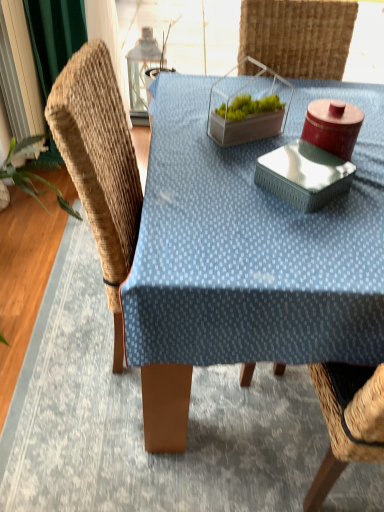
At what (x,y) coordinates should I click in order to perform the action: click on woven wood swivel chair at left. Please return your answer as a coordinate pair (x, y). The height and width of the screenshot is (512, 384). Looking at the image, I should click on (100, 165).

The height and width of the screenshot is (512, 384). What do you see at coordinates (100, 165) in the screenshot?
I see `woven wood swivel chair at left` at bounding box center [100, 165].

What do you see at coordinates (247, 256) in the screenshot? I see `blue fabric table at center` at bounding box center [247, 256].

Find the location of `blue fabric table at center`. blue fabric table at center is located at coordinates (247, 256).

Where is `woven wood swivel chair at left`? woven wood swivel chair at left is located at coordinates (100, 165).

Between woven wood swivel chair at left and blue fabric table at center, which one appears on the right side from the viewer's perspective?

blue fabric table at center is more to the right.

Is the depth of woven wood swivel chair at left less than that of blue fabric table at center?

No, it is not.

Which point is more distant from viewer, (123,230) or (379,114)?

The point (379,114) is more distant.

From the image's perspective, would you say woven wood swivel chair at left is positioned over blue fabric table at center?

Yes, from the image's perspective, woven wood swivel chair at left is above blue fabric table at center.

From a real-world perspective, who is located higher, woven wood swivel chair at left or blue fabric table at center?

From a 3D spatial view, woven wood swivel chair at left is above.

Between woven wood swivel chair at left and blue fabric table at center, which one has smaller width?

Thinner between the two is woven wood swivel chair at left.

Is woven wood swivel chair at left taller than blue fabric table at center?

Correct, woven wood swivel chair at left is much taller as blue fabric table at center.

Considering the sizes of objects woven wood swivel chair at left and blue fabric table at center in the image provided, who is smaller, woven wood swivel chair at left or blue fabric table at center?

With smaller size is woven wood swivel chair at left.

Is woven wood swivel chair at left inside the boundaries of blue fabric table at center, or outside?

woven wood swivel chair at left is located inside blue fabric table at center.

Does woven wood swivel chair at left touch blue fabric table at center?

No, woven wood swivel chair at left is not beside blue fabric table at center.

Is woven wood swivel chair at left oriented towards blue fabric table at center?

Yes, woven wood swivel chair at left is aimed at blue fabric table at center.

Can you tell me how much woven wood swivel chair at left and blue fabric table at center differ in facing direction?

The angle between the facing direction of woven wood swivel chair at left and the facing direction of blue fabric table at center is 92.4 degrees.

You are a GUI agent. You are given a task and a screenshot of the screen. Output one action in this format:
    pyautogui.click(x=<x>, y=<y>)
    Task: Click on the swivel chair above the blue fabric table at center (from a real-world perspective)
    
    Given the screenshot: What is the action you would take?
    pyautogui.click(x=100, y=165)

In the scene shown: Between blue fabric table at center and woven wood swivel chair at left, which one appears on the left side from the viewer's perspective?

woven wood swivel chair at left is more to the left.

Is the position of blue fabric table at center less distant than that of woven wood swivel chair at left?

Yes, it is in front of woven wood swivel chair at left.

Considering the points (358, 336) and (97, 240), which point is behind, point (358, 336) or point (97, 240)?

Point (97, 240)

From the image's perspective, between blue fabric table at center and woven wood swivel chair at left, which one is located above?

woven wood swivel chair at left appears higher in the image.

From a real-world perspective, who is located lower, blue fabric table at center or woven wood swivel chair at left?

blue fabric table at center.

Is blue fabric table at center wider than woven wood swivel chair at left?

Correct, the width of blue fabric table at center exceeds that of woven wood swivel chair at left.

Can you confirm if blue fabric table at center is taller than woven wood swivel chair at left?

No, blue fabric table at center is not taller than woven wood swivel chair at left.

Does blue fabric table at center have a larger size compared to woven wood swivel chair at left?

Indeed, blue fabric table at center has a larger size compared to woven wood swivel chair at left.

Consider the image. Could woven wood swivel chair at left be considered to be inside blue fabric table at center?

Yes, blue fabric table at center is surrounding woven wood swivel chair at left.

Is there a large distance between blue fabric table at center and woven wood swivel chair at left?

That's not correct — blue fabric table at center is a little close to woven wood swivel chair at left.

Is blue fabric table at center facing towards woven wood swivel chair at left?

No, blue fabric table at center is not aimed at woven wood swivel chair at left.

Can you tell me how much blue fabric table at center and woven wood swivel chair at left differ in facing direction?

The facing directions of blue fabric table at center and woven wood swivel chair at left are 92.4 degrees apart.

I want to click on swivel chair that appears above the blue fabric table at center (from a real-world perspective), so pos(100,165).

This screenshot has width=384, height=512. In order to click on table in front of the woven wood swivel chair at left in this screenshot , I will do `click(247, 256)`.

I want to click on swivel chair above the blue fabric table at center (from the image's perspective), so click(100, 165).